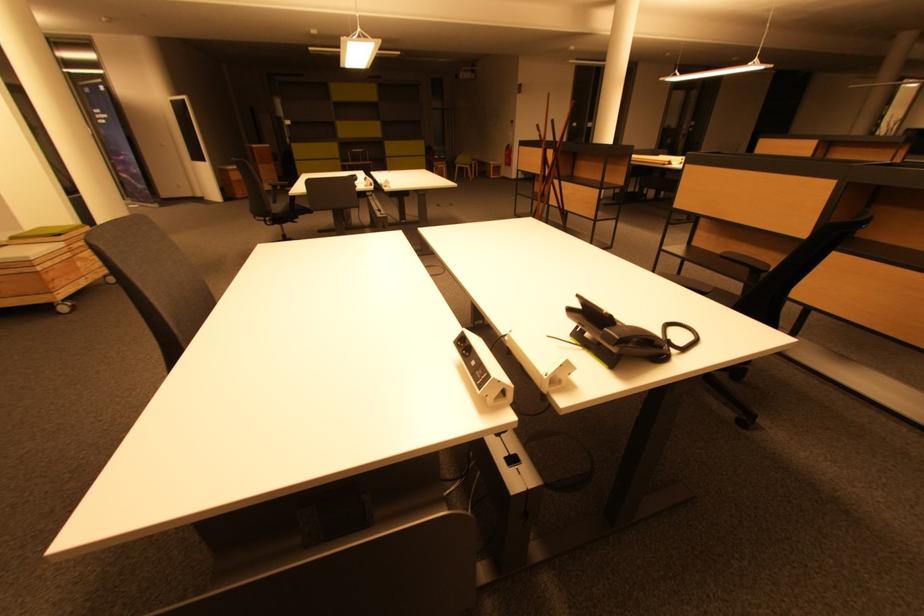
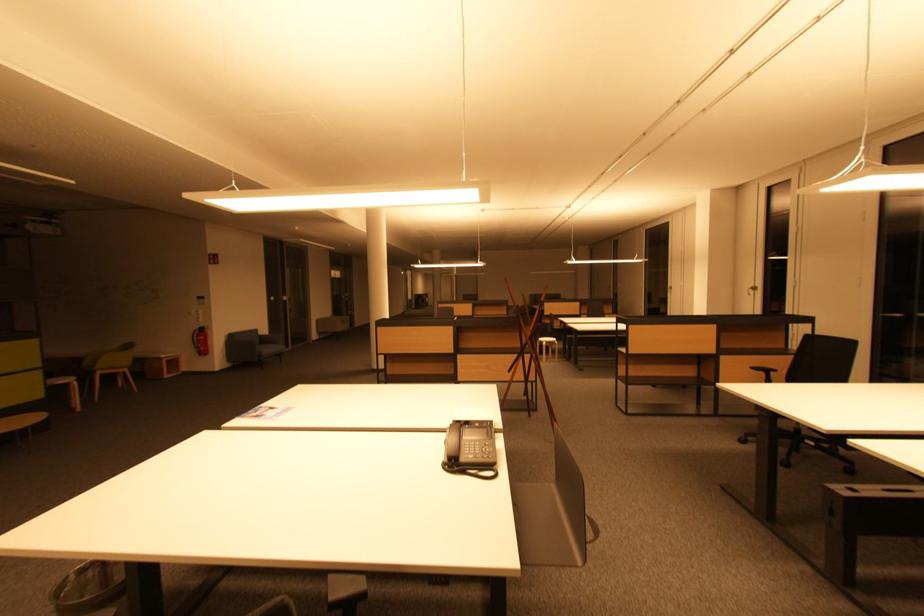
Find the pixel in the second image that matches (x=459, y=167) in the first image.

(98, 374)